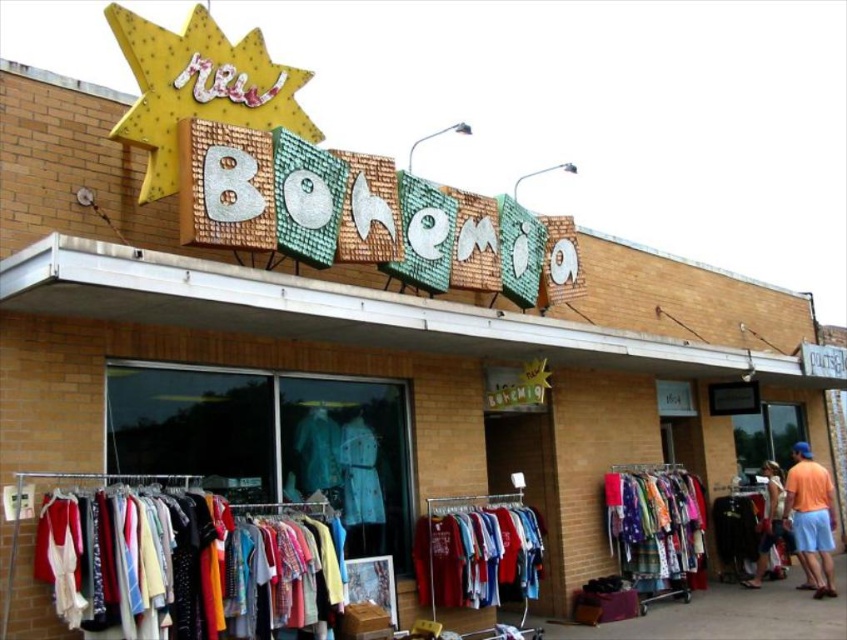
You are standing in front of the vintage clothing store named Bohemia. You see two points marked on the storefront. The first point is at coordinates point (314, 465) and the second point is at point (710, 512). Which point is closer to you?

Point (314, 465) is in front of point (710, 512), so it is closer to you.

You are standing outside the vintage clothing store and want to find the teal fabric dress at center. According to the store layout, where should you look relative to the entrance?

The teal fabric dress at center is located at point [316,451], so you should look towards the center area of the store, slightly to the right and halfway up from the entrance.